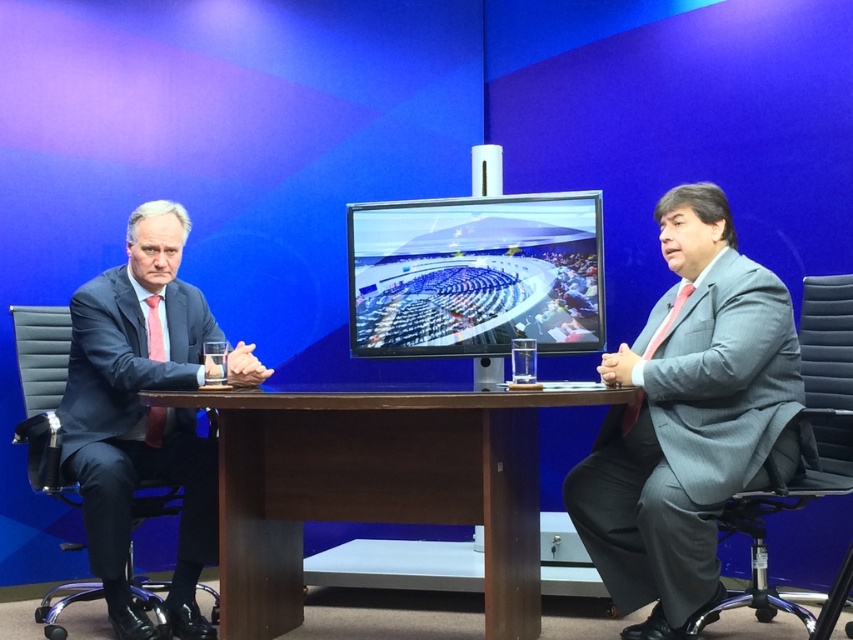
Is brown wood table at center bigger than matte black monitor at center?

Yes.

Can you confirm if brown wood table at center is shorter than matte black monitor at center?

No, brown wood table at center is not shorter than matte black monitor at center.

Between point (538, 573) and point (399, 340), which one is positioned behind?

The point (399, 340) is behind.

You are a GUI agent. You are given a task and a screenshot of the screen. Output one action in this format:
    pyautogui.click(x=<x>, y=<y>)
    Task: Click on the brown wood table at center
    This screenshot has width=853, height=640.
    Given the screenshot: What is the action you would take?
    pyautogui.click(x=375, y=484)

Is matte black monitor at center positioned before gray fabric swivel chair at right?

No, matte black monitor at center is behind gray fabric swivel chair at right.

From the picture: Which is below, matte black monitor at center or gray fabric swivel chair at right?

gray fabric swivel chair at right is below.

Does point (370, 336) come in front of point (834, 467)?

No, (370, 336) is further to viewer.

I want to click on matte black monitor at center, so click(474, 275).

In the scene shown: Is gray fabric swivel chair at right to the left of black leather swivel chair at left from the viewer's perspective?

In fact, gray fabric swivel chair at right is to the right of black leather swivel chair at left.

This screenshot has width=853, height=640. I want to click on gray fabric swivel chair at right, so click(x=799, y=460).

What are the coordinates of `gray fabric swivel chair at right` in the screenshot? It's located at (799, 460).